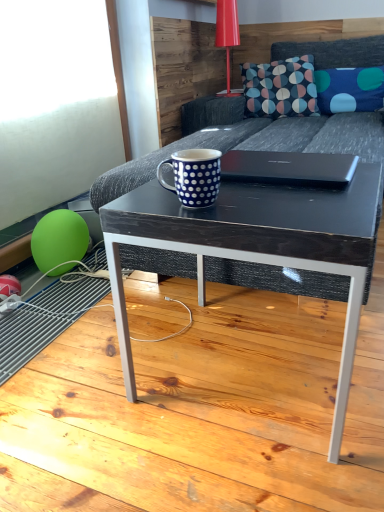
Question: Considering the relative sizes of dark gray fabric couch at center and glossy plastic table lamp at upper center in the image provided, is dark gray fabric couch at center smaller than glossy plastic table lamp at upper center?

Choices:
 (A) no
 (B) yes

Answer: (A)

Question: Does dark gray fabric couch at center appear on the left side of glossy plastic table lamp at upper center?

Choices:
 (A) yes
 (B) no

Answer: (B)

Question: Would you say dark gray fabric couch at center contains glossy plastic table lamp at upper center?

Choices:
 (A) no
 (B) yes

Answer: (B)

Question: Does dark gray fabric couch at center appear on the right side of glossy plastic table lamp at upper center?

Choices:
 (A) yes
 (B) no

Answer: (A)

Question: Is dark gray fabric couch at center oriented away from glossy plastic table lamp at upper center?

Choices:
 (A) no
 (B) yes

Answer: (A)

Question: From a real-world perspective, does dark gray fabric couch at center sit lower than glossy plastic table lamp at upper center?

Choices:
 (A) no
 (B) yes

Answer: (B)

Question: Is dark wood/black textured coffee table at center far away from blue dotted fabric pillow at upper right?

Choices:
 (A) yes
 (B) no

Answer: (A)

Question: Is dark wood/black textured coffee table at center in contact with blue dotted fabric pillow at upper right?

Choices:
 (A) yes
 (B) no

Answer: (B)

Question: Does dark wood/black textured coffee table at center lie in front of blue dotted fabric pillow at upper right?

Choices:
 (A) yes
 (B) no

Answer: (A)

Question: Is dark wood/black textured coffee table at center smaller than blue dotted fabric pillow at upper right?

Choices:
 (A) no
 (B) yes

Answer: (A)

Question: From a real-world perspective, is dark wood/black textured coffee table at center beneath blue dotted fabric pillow at upper right?

Choices:
 (A) no
 (B) yes

Answer: (B)

Question: Considering the relative sizes of dark wood/black textured coffee table at center and blue dotted fabric pillow at upper right in the image provided, is dark wood/black textured coffee table at center bigger than blue dotted fabric pillow at upper right?

Choices:
 (A) yes
 (B) no

Answer: (A)

Question: Is dark blue fabric pillow with colorful circles at upper center positioned before glossy plastic table lamp at upper center?

Choices:
 (A) no
 (B) yes

Answer: (B)